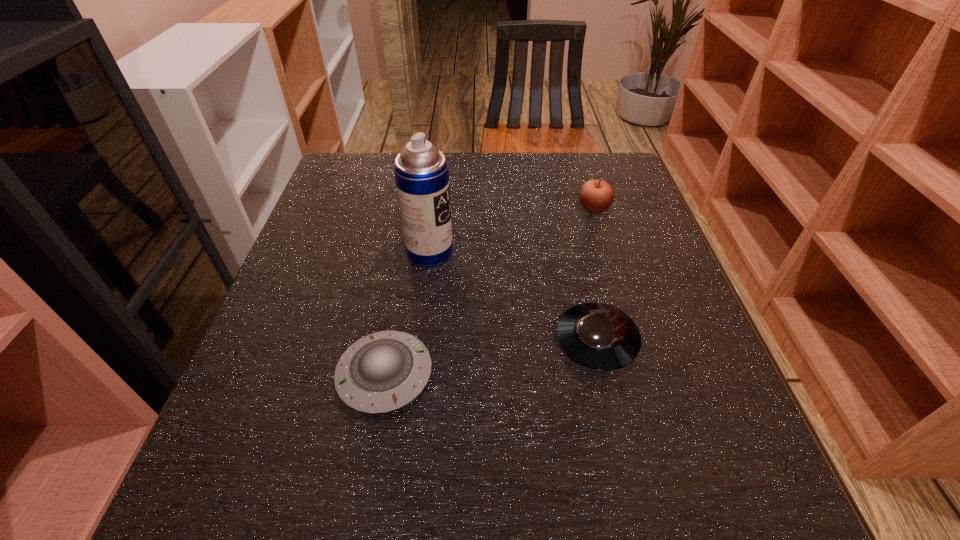
Where is `object that is the second closest to the right saucer`? The height and width of the screenshot is (540, 960). object that is the second closest to the right saucer is located at coordinates (421, 171).

Find the location of `object that is the second nearest to the second tallest object`. object that is the second nearest to the second tallest object is located at coordinates (421, 171).

The image size is (960, 540). In order to click on free spot that satisfies the following two spatial constraints: 1. on the label side of the aerosol can; 2. on the right side of the right saucer in this screenshot , I will do `click(420, 342)`.

You are a GUI agent. You are given a task and a screenshot of the screen. Output one action in this format:
    pyautogui.click(x=<x>, y=<y>)
    Task: Click on the vacant space that satisfies the following two spatial constraints: 1. on the back side of the farthest object; 2. on the left side of the shortest object
    Image resolution: width=960 pixels, height=540 pixels.
    Given the screenshot: What is the action you would take?
    pyautogui.click(x=414, y=210)

You are a GUI agent. You are given a task and a screenshot of the screen. Output one action in this format:
    pyautogui.click(x=<x>, y=<y>)
    Task: Click on the free space in the image that satisfies the following two spatial constraints: 1. on the label side of the third nearest object; 2. on the left side of the right saucer
    The image size is (960, 540).
    Given the screenshot: What is the action you would take?
    pyautogui.click(x=420, y=342)

I want to click on free space that satisfies the following two spatial constraints: 1. on the front side of the third shortest object; 2. on the label side of the third nearest object, so click(x=607, y=252).

I want to click on vacant area that satisfies the following two spatial constraints: 1. on the label side of the tallest object; 2. on the front side of the shortest object, so click(x=415, y=375).

I want to click on free spot that satisfies the following two spatial constraints: 1. on the front side of the apple; 2. on the label side of the aerosol can, so (607, 252).